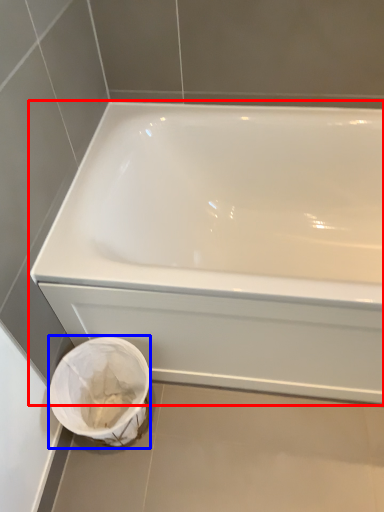
Question: Among these objects, which one is farthest to the camera, bathtub (highlighted by a red box) or porcelain (highlighted by a blue box)?

Choices:
 (A) bathtub
 (B) porcelain

Answer: (B)